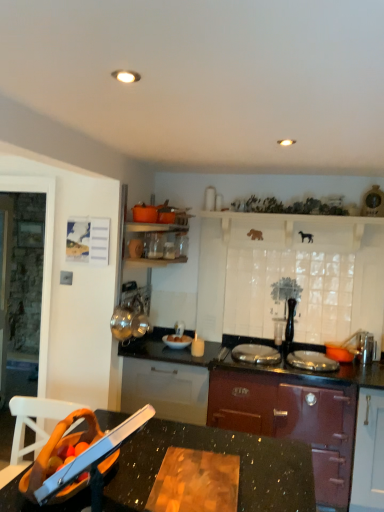
Question: From the image's perspective, relative to white glossy bowl at center, is black granite countertop at lower center above or below?

Choices:
 (A) above
 (B) below

Answer: (B)

Question: Is point (152, 452) closer or farther from the camera than point (173, 337)?

Choices:
 (A) farther
 (B) closer

Answer: (B)

Question: Considering the real-world distances, which object is closest to the matte burgundy stove at center?

Choices:
 (A) white glossy bowl at center
 (B) black granite countertop at lower center
 (C) metallic sink at lower center
 (D) white matte cabinet at upper center

Answer: (A)

Question: Which object is positioned farthest from the white glossy bowl at center?

Choices:
 (A) metallic sink at lower center
 (B) black granite countertop at lower center
 (C) matte burgundy stove at center
 (D) white matte cabinet at upper center

Answer: (A)